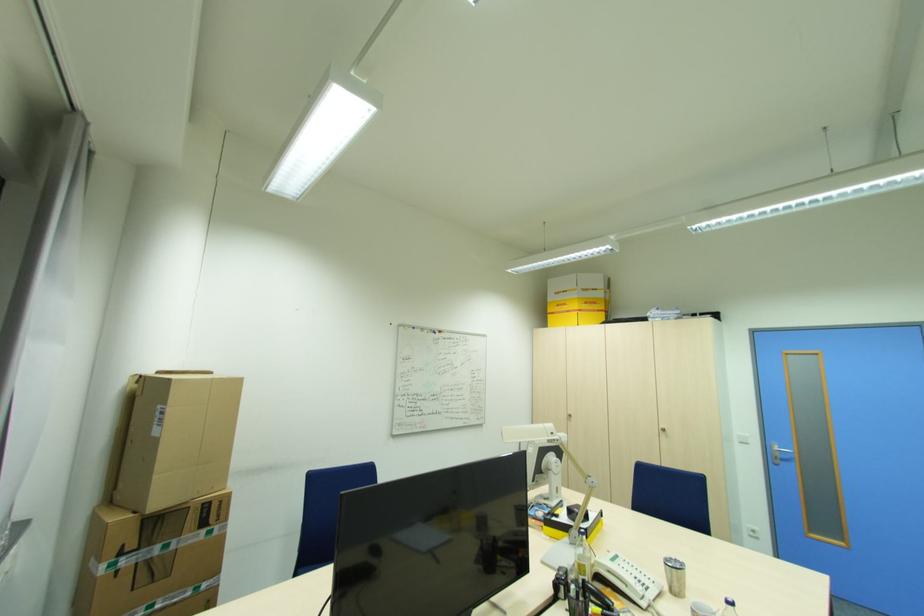
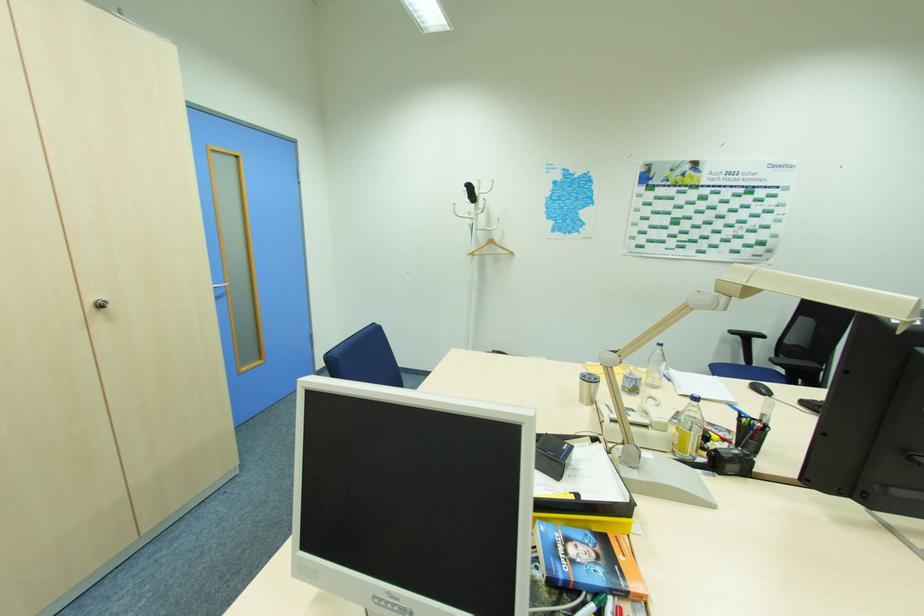
In the second image, find the point that corresponds to point (666, 430) in the first image.

(103, 306)